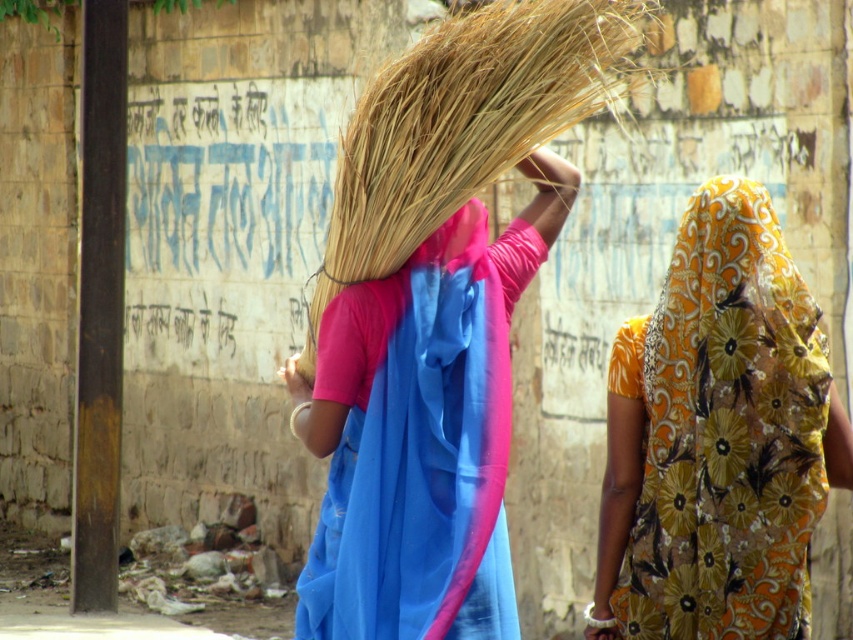
Question: Is blue silk sari at center below dry straw broom at center?

Choices:
 (A) no
 (B) yes

Answer: (B)

Question: Is blue silk sari at center thinner than dry straw broom at center?

Choices:
 (A) no
 (B) yes

Answer: (B)

Question: Estimate the real-world distances between objects in this image. Which object is farther from the floral yellow fabric at upper right?

Choices:
 (A) blue silk sari at center
 (B) dry straw broom at center

Answer: (B)

Question: Which point is closer to the camera?

Choices:
 (A) (692, 260)
 (B) (345, 365)

Answer: (A)

Question: From the image, what is the correct spatial relationship of floral yellow fabric at upper right in relation to blue silk sari at center?

Choices:
 (A) above
 (B) below

Answer: (B)

Question: Which object appears farthest from the camera in this image?

Choices:
 (A) dry straw broom at center
 (B) blue silk sari at center
 (C) floral yellow fabric at upper right

Answer: (A)